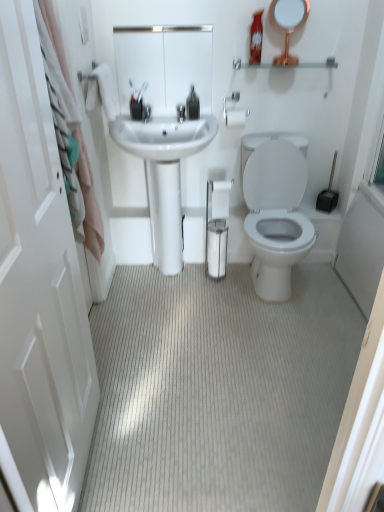
This screenshot has width=384, height=512. I want to click on white matte toilet paper at center, so click(220, 198).

The height and width of the screenshot is (512, 384). What do you see at coordinates (220, 198) in the screenshot?
I see `white matte toilet paper at center` at bounding box center [220, 198].

Locate an element on the screen. The height and width of the screenshot is (512, 384). neutral carpet at center is located at coordinates (217, 391).

Consider the image. Can you tell me how much white matte toilet paper at center and white glossy sink at center differ in facing direction?

white matte toilet paper at center and white glossy sink at center are facing 0.284 degrees away from each other.

Based on the photo, who is smaller, white matte toilet paper at center or white glossy sink at center?

With smaller size is white matte toilet paper at center.

Is white matte toilet paper at center not inside white glossy sink at center?

No, white matte toilet paper at center is inside white glossy sink at center's boundary.

Is white matte toilet paper at center turned away from white glossy sink at center?

No.

Is neutral carpet at center looking in the opposite direction of silver metallic towel bar at upper center?

That's not correct — neutral carpet at center is not looking away from silver metallic towel bar at upper center.

Identify the location of plain to the left of silver metallic towel bar at upper center. Image resolution: width=384 pixels, height=512 pixels. (217, 391).

Considering the sizes of neutral carpet at center and silver metallic towel bar at upper center in the image, is neutral carpet at center bigger or smaller than silver metallic towel bar at upper center?

Clearly, neutral carpet at center is larger in size than silver metallic towel bar at upper center.

Considering the sizes of objects neutral carpet at center and silver metallic towel bar at upper center in the image provided, who is taller, neutral carpet at center or silver metallic towel bar at upper center?

With more height is silver metallic towel bar at upper center.

Is neutral carpet at center facing away from gold metallic mirror at upper right, which appears as the first mirror when viewed from the right?

No, neutral carpet at center is not facing the opposite direction of gold metallic mirror at upper right, which appears as the first mirror when viewed from the right.

Looking at this image, is neutral carpet at center beside gold metallic mirror at upper right, which appears as the first mirror when viewed from the right?

No, neutral carpet at center is not beside gold metallic mirror at upper right, which appears as the first mirror when viewed from the right.

Does neutral carpet at center have a greater height compared to gold metallic mirror at upper right, which appears as the first mirror when viewed from the right?

Incorrect, the height of neutral carpet at center is not larger of that of gold metallic mirror at upper right, which appears as the first mirror when viewed from the right.

Which object is thinner, neutral carpet at center or gold metallic mirror at upper right, which appears as the first mirror when viewed from the right?

Thinner between the two is gold metallic mirror at upper right, which appears as the first mirror when viewed from the right.

Considering the sizes of gold metallic mirror at upper right, which appears as the 2th mirror when viewed from the left, and white matte toilet paper at center in the image, is gold metallic mirror at upper right, which appears as the 2th mirror when viewed from the left, taller or shorter than white matte toilet paper at center?

Considering their sizes, gold metallic mirror at upper right, which appears as the 2th mirror when viewed from the left, has more height than white matte toilet paper at center.

How far apart are gold metallic mirror at upper right, which appears as the 2th mirror when viewed from the left, and white matte toilet paper at center?

A distance of 82.88 centimeters exists between gold metallic mirror at upper right, which appears as the 2th mirror when viewed from the left, and white matte toilet paper at center.

Between gold metallic mirror at upper right, which appears as the first mirror when viewed from the right, and white matte toilet paper at center, which one appears on the left side from the viewer's perspective?

Positioned to the left is white matte toilet paper at center.

Is gold metallic mirror at upper right, which appears as the first mirror when viewed from the right, situated inside white matte toilet paper at center or outside?

gold metallic mirror at upper right, which appears as the first mirror when viewed from the right, is outside white matte toilet paper at center.

From the picture: Can you confirm if white glossy sink at center is smaller than neutral carpet at center?

Actually, white glossy sink at center might be larger than neutral carpet at center.

Does white glossy sink at center turn towards neutral carpet at center?

Yes.

Who is shorter, white glossy sink at center or neutral carpet at center?

Standing shorter between the two is neutral carpet at center.

You are a GUI agent. You are given a task and a screenshot of the screen. Output one action in this format:
    pyautogui.click(x=<x>, y=<y>)
    Task: Click on the toilet paper beneath the white glossy mirror at upper center, which is the second mirror from right to left (from a real-world perspective)
    This screenshot has height=512, width=384.
    Given the screenshot: What is the action you would take?
    [220, 198]

From the image's perspective, does white matte toilet paper at center appear lower than white glossy mirror at upper center, which is the second mirror from right to left?

Yes, from the image's perspective, white matte toilet paper at center is beneath white glossy mirror at upper center, which is the second mirror from right to left.

Considering the sizes of objects neutral carpet at center and white glossy sink at center in the image provided, who is taller, neutral carpet at center or white glossy sink at center?

white glossy sink at center.

From a real-world perspective, is neutral carpet at center physically below white glossy sink at center?

Yes, from a real-world perspective, neutral carpet at center is below white glossy sink at center.

Is neutral carpet at center outside of white glossy sink at center?

Yes, neutral carpet at center is not within white glossy sink at center.

Could you tell me if neutral carpet at center is facing white glossy sink at center?

No, neutral carpet at center is not facing towards white glossy sink at center.

Where is `sink above the white matte toilet paper at center (from the image's perspective)`? The image size is (384, 512). sink above the white matte toilet paper at center (from the image's perspective) is located at coordinates (164, 175).

Where is `towel bar on the right of neutral carpet at center`? The width and height of the screenshot is (384, 512). towel bar on the right of neutral carpet at center is located at coordinates (234, 112).

Estimate the real-world distances between objects in this image. Which object is closer to clear glass shelf at upper center, gold metallic mirror at upper right, which appears as the first mirror when viewed from the right, or white glossy mirror at upper center, placed as the first mirror when sorted from left to right?

The object closer to clear glass shelf at upper center is gold metallic mirror at upper right, which appears as the first mirror when viewed from the right.

Looking at the image, which one is located closer to white fabric shower curtain at left, white matte toilet paper at center or white glossy mirror at upper center, which is the second mirror from right to left?

white matte toilet paper at center is positioned closer to the anchor white fabric shower curtain at left.

Which object lies further to the anchor point gold metallic mirror at upper right, which appears as the first mirror when viewed from the right, white fabric shower curtain at left or white glossy sink at center?

white fabric shower curtain at left lies further to gold metallic mirror at upper right, which appears as the first mirror when viewed from the right, than the other object.

Which object lies further to the anchor point silver metallic towel bar at upper center, neutral carpet at center or white glossy sink at center?

The object further to silver metallic towel bar at upper center is neutral carpet at center.

From the image, which object appears to be farther from white matte toilet paper at center, neutral carpet at center or gold metallic mirror at upper right, which appears as the first mirror when viewed from the right?

Among the two, gold metallic mirror at upper right, which appears as the first mirror when viewed from the right, is located further to white matte toilet paper at center.

Looking at this image, which object lies further to the anchor point white glossy sink at center, white glossy mirror at upper center, which is the second mirror from right to left, or white glossy screen door at left?

Among the two, white glossy screen door at left is located further to white glossy sink at center.

When comparing their distances from white matte toilet paper at center, does white glossy mirror at upper center, placed as the first mirror when sorted from left to right, or neutral carpet at center seem further?

Among the two, neutral carpet at center is located further to white matte toilet paper at center.

Based on their spatial positions, is gold metallic mirror at upper right, which appears as the first mirror when viewed from the right, or silver metallic towel bar at upper center further from white glossy screen door at left?

gold metallic mirror at upper right, which appears as the first mirror when viewed from the right, is positioned further to the anchor white glossy screen door at left.

Where is `towel bar situated between white glossy mirror at upper center, placed as the first mirror when sorted from left to right, and clear glass shelf at upper center from left to right`? Image resolution: width=384 pixels, height=512 pixels. towel bar situated between white glossy mirror at upper center, placed as the first mirror when sorted from left to right, and clear glass shelf at upper center from left to right is located at coordinates (234, 112).

You are a GUI agent. You are given a task and a screenshot of the screen. Output one action in this format:
    pyautogui.click(x=<x>, y=<y>)
    Task: Click on the towel bar between clear glass shelf at upper center and white glossy sink at center vertically
    
    Given the screenshot: What is the action you would take?
    pyautogui.click(x=234, y=112)

Identify the location of sink between white glossy mirror at upper center, which is the second mirror from right to left, and white matte toilet paper at center vertically. The image size is (384, 512). (164, 175).

Find the location of a particular element. This screenshot has height=512, width=384. mirror between gold metallic mirror at upper right, which appears as the 2th mirror when viewed from the left, and white matte toilet paper at center, in the vertical direction is located at coordinates (164, 65).